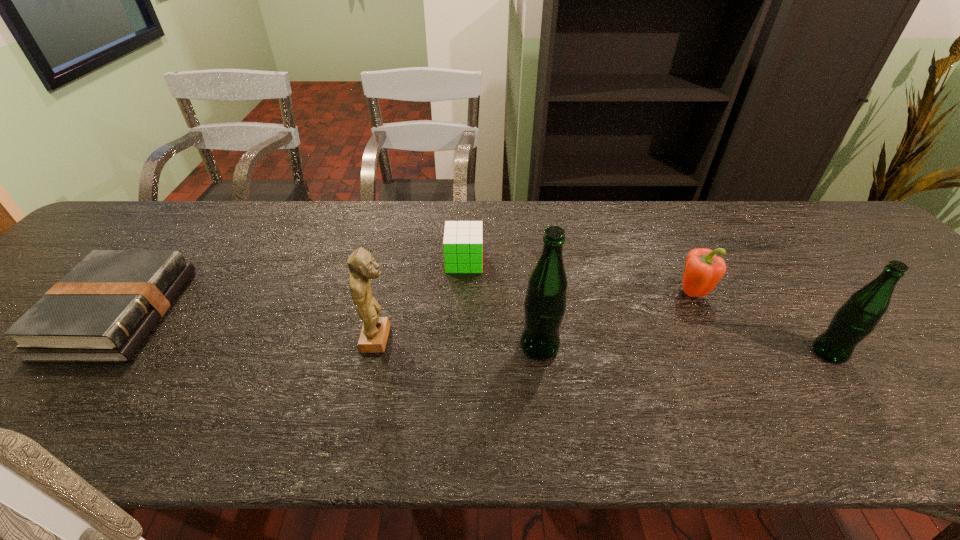
The height and width of the screenshot is (540, 960). In order to click on free space between the rightmost object and the third object from left to right in this screenshot , I will do `click(647, 307)`.

What are the coordinates of `the closest object to the right beer bottle` in the screenshot? It's located at (703, 269).

This screenshot has height=540, width=960. Find the location of `object that can be found as the third closest to the tallest object`. object that can be found as the third closest to the tallest object is located at coordinates (703, 269).

Locate an element on the screen. The height and width of the screenshot is (540, 960). vacant region that satisfies the following two spatial constraints: 1. on the front side of the third object from left to right; 2. on the right side of the fourth tallest object is located at coordinates (463, 293).

You are a GUI agent. You are given a task and a screenshot of the screen. Output one action in this format:
    pyautogui.click(x=<x>, y=<y>)
    Task: Click on the vacant area in the image that satisfies the following two spatial constraints: 1. on the spine side of the leftmost object; 2. on the back side of the left beer bottle
    The width and height of the screenshot is (960, 540).
    Given the screenshot: What is the action you would take?
    pyautogui.click(x=91, y=346)

Where is `vacant space that satisfies the following two spatial constraints: 1. on the spine side of the shortest object; 2. on the right side of the rightmost object`? The height and width of the screenshot is (540, 960). vacant space that satisfies the following two spatial constraints: 1. on the spine side of the shortest object; 2. on the right side of the rightmost object is located at coordinates (85, 353).

You are a GUI agent. You are given a task and a screenshot of the screen. Output one action in this format:
    pyautogui.click(x=<x>, y=<y>)
    Task: Click on the free space in the image that satisfies the following two spatial constraints: 1. on the front-facing side of the shorter beer bottle; 2. on the right side of the figurine
    This screenshot has width=960, height=540.
    Given the screenshot: What is the action you would take?
    pyautogui.click(x=374, y=353)

The width and height of the screenshot is (960, 540). Find the location of `blank area in the image that satisfies the following two spatial constraints: 1. on the front-facing side of the figurine; 2. on the left side of the right beer bottle`. blank area in the image that satisfies the following two spatial constraints: 1. on the front-facing side of the figurine; 2. on the left side of the right beer bottle is located at coordinates tap(374, 353).

I want to click on vacant space that satisfies the following two spatial constraints: 1. on the front side of the second shortest object; 2. on the front-facing side of the figurine, so click(461, 339).